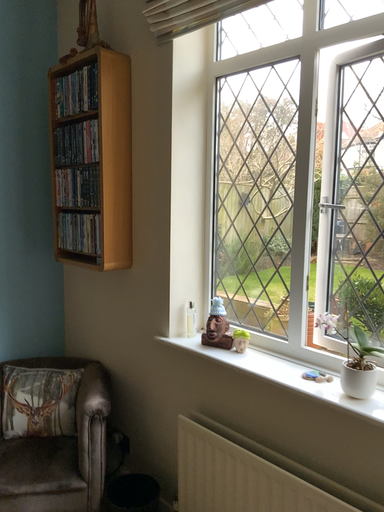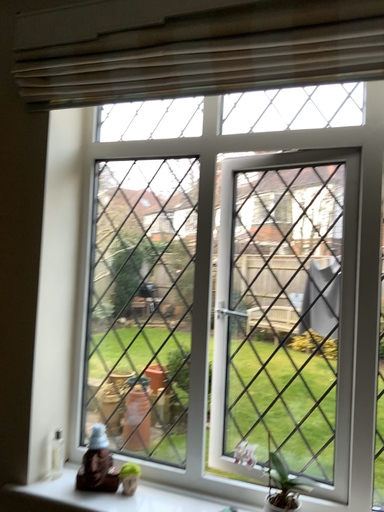
Question: Which way did the camera rotate in the video?

Choices:
 (A) rotated left
 (B) rotated right

Answer: (B)